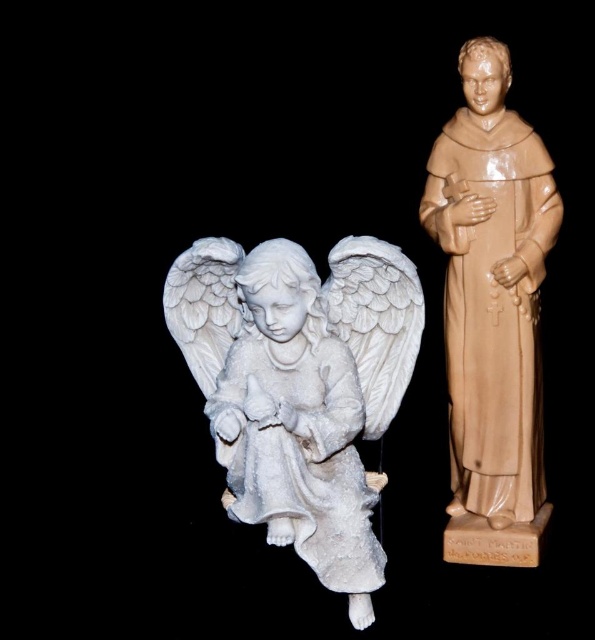
Question: Is white marble angel at left below matte beige statue at right?

Choices:
 (A) no
 (B) yes

Answer: (B)

Question: In this image, where is white marble angel at left located relative to matte beige statue at right?

Choices:
 (A) above
 (B) below

Answer: (B)

Question: Which of the following is the closest to the observer?

Choices:
 (A) (187, 348)
 (B) (487, 257)

Answer: (B)

Question: Can you confirm if white marble angel at left is positioned to the left of matte beige statue at right?

Choices:
 (A) no
 (B) yes

Answer: (B)